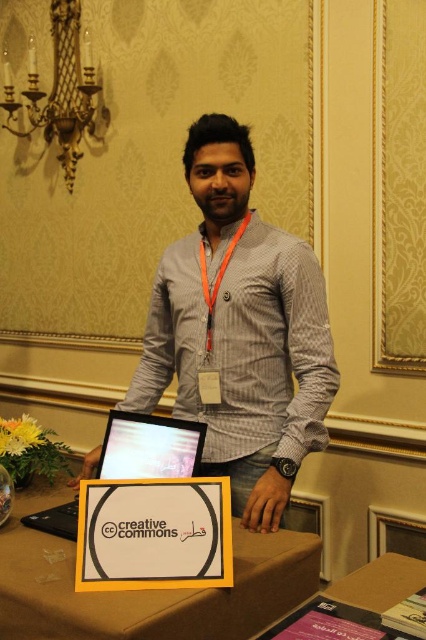
What are the coordinates of the yellow fabric table at center?

The yellow fabric table at center is located at coordinates point (146, 589).

The man is holding a white paper at center and has a skinny orange lanyard at center. Which object is bigger in size?

The white paper at center is larger in size than the skinny orange lanyard at center.